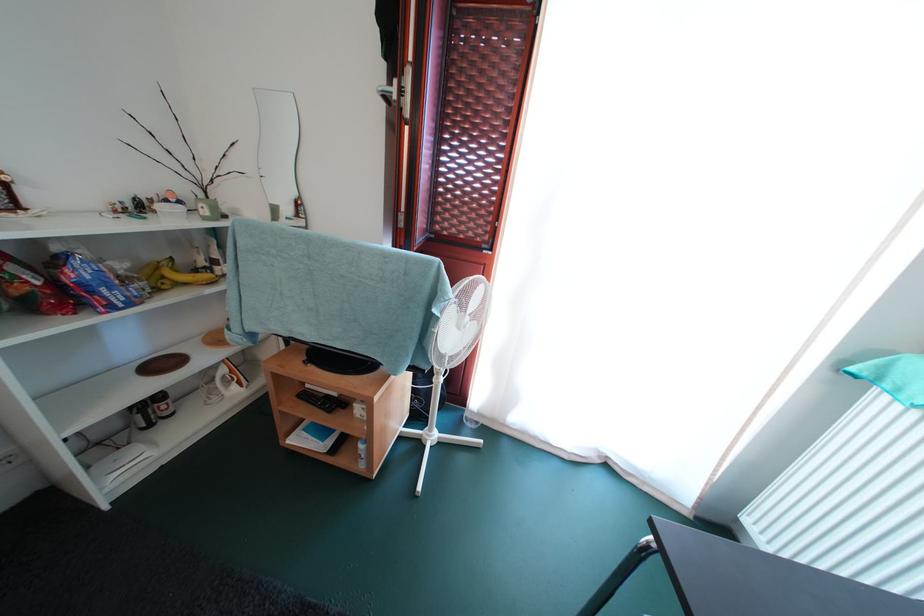
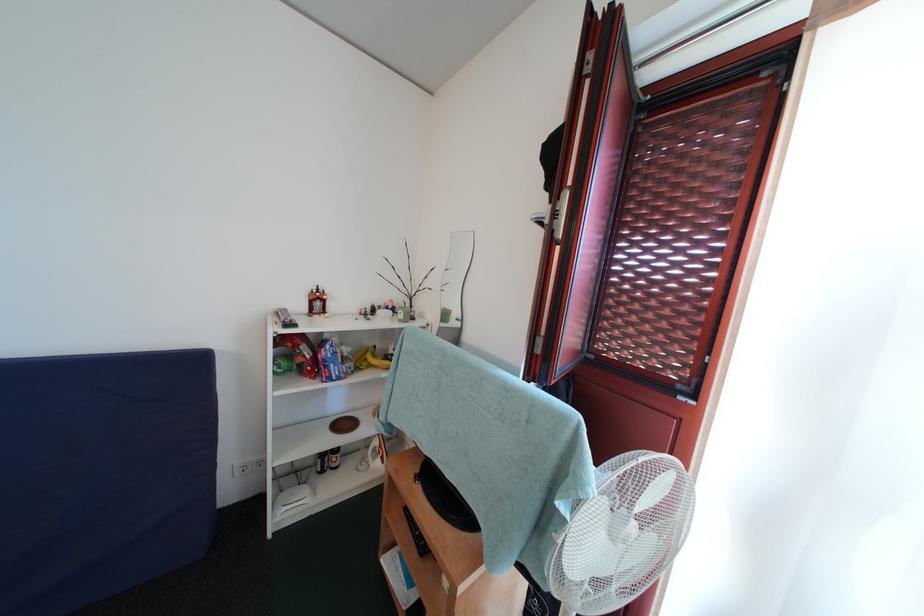
Based on the continuous images, in which direction is the camera rotating?

The rotation direction of the camera is left-up.